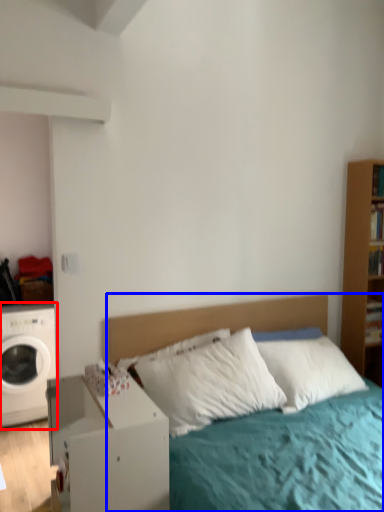
Question: Which object is further to the camera taking this photo, washing machine (highlighted by a red box) or bed (highlighted by a blue box)?

Choices:
 (A) washing machine
 (B) bed

Answer: (A)